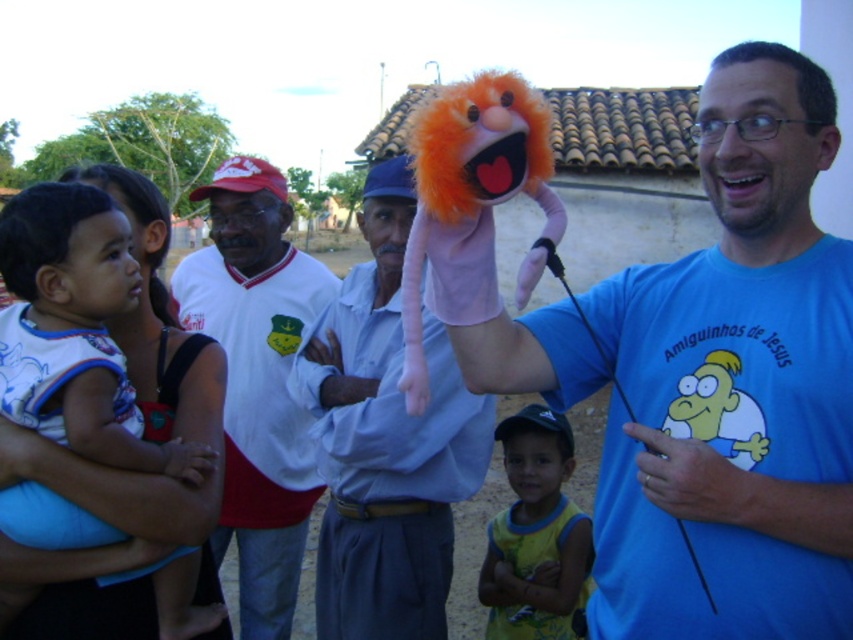
From the picture: Which of these two, orange furry puppet at upper center or fluffy orange puppet at center, stands taller?

With more height is orange furry puppet at upper center.

Can you confirm if orange furry puppet at upper center is positioned to the right of fluffy orange puppet at center?

Correct, you'll find orange furry puppet at upper center to the right of fluffy orange puppet at center.

Is point (495, 372) behind point (480, 122)?

Yes, it is behind point (480, 122).

At what (x,y) coordinates should I click in order to perform the action: click on orange furry puppet at upper center. Please return your answer as a coordinate pair (x, y). The image size is (853, 640). Looking at the image, I should click on (734, 387).

Measure the distance from light blue cotton shirt at center to fluffy orange puppet at center.

light blue cotton shirt at center and fluffy orange puppet at center are 33.17 inches apart.

Can you confirm if light blue cotton shirt at center is thinner than fluffy orange puppet at center?

In fact, light blue cotton shirt at center might be wider than fluffy orange puppet at center.

Who is more distant from viewer, [372,576] or [473,180]?

Positioned behind is point [372,576].

The width and height of the screenshot is (853, 640). I want to click on light blue cotton shirt at center, so click(x=386, y=442).

Identify the location of fluffy orange puppet at center. The height and width of the screenshot is (640, 853). (469, 182).

Who is positioned more to the left, fluffy orange puppet at center or orange plush puppet at upper center?

Positioned to the left is fluffy orange puppet at center.

Where is `fluffy orange puppet at center`? This screenshot has height=640, width=853. fluffy orange puppet at center is located at coordinates (469, 182).